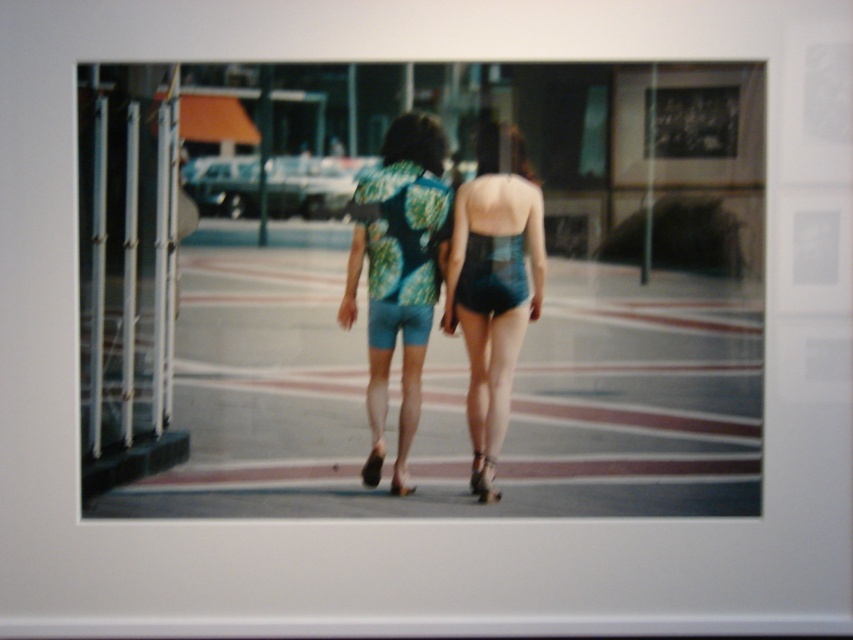
You are standing in the plaza and want to walk towards the two people. Which of the two points, point (543, 278) or point (418, 291), is closer to you as you move forward?

Point (543, 278) is closer to the viewer than point (418, 291), so you should head towards point (543, 278) first.

You are a photographer positioned at the back of the plaza. You want to take a photo of both the teal fabric shorts at center and the green floral fabric dress at center without any obstruction. Which one should you focus on first to ensure it appears sharp in the photo?

The teal fabric shorts at center is closer to you than the green floral fabric dress at center, so you should focus on the teal fabric shorts at center first to ensure it appears sharp in the photo.

You are a fashion designer observing the two individuals in the scene. You need to determine which clothing item, the teal fabric shorts at center or the green floral fabric dress at center, would require more fabric to produce. Based on their sizes, which one would need more material?

The teal fabric shorts at center has a larger size compared to the green floral fabric dress at center, so it would require more fabric to produce.